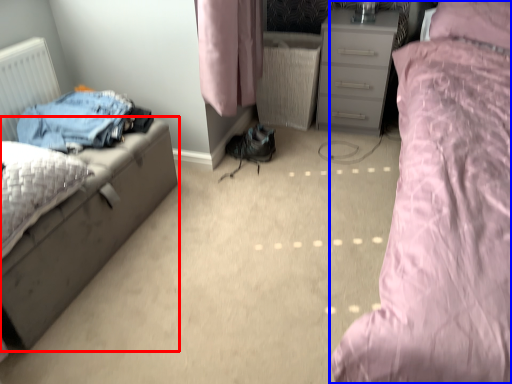
Question: Which of the following is the farthest to the observer, nightstand (highlighted by a red box) or bed (highlighted by a blue box)?

Choices:
 (A) nightstand
 (B) bed

Answer: (A)